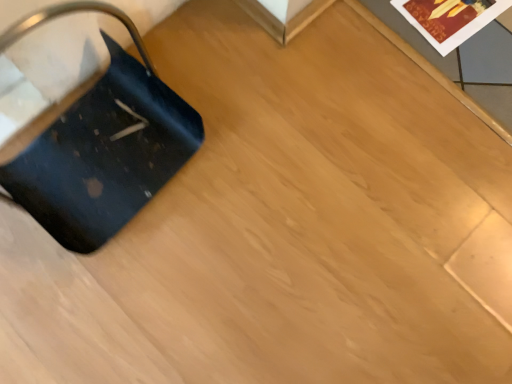
Where is `matte paper postcard at upper right`? matte paper postcard at upper right is located at coordinates (449, 19).

What do you see at coordinates (449, 19) in the screenshot? I see `matte paper postcard at upper right` at bounding box center [449, 19].

Locate an element on the screen. The height and width of the screenshot is (384, 512). matte black suitcase at left is located at coordinates (102, 144).

This screenshot has height=384, width=512. Describe the element at coordinates (102, 144) in the screenshot. I see `matte black suitcase at left` at that location.

This screenshot has height=384, width=512. I want to click on matte paper postcard at upper right, so click(449, 19).

Which object is positioned more to the right, matte black suitcase at left or matte paper postcard at upper right?

Positioned to the right is matte paper postcard at upper right.

Who is more distant, matte black suitcase at left or matte paper postcard at upper right?

matte paper postcard at upper right is further from the camera.

Considering the points (46, 212) and (465, 8), which point is in front, point (46, 212) or point (465, 8)?

Positioned in front is point (46, 212).

From the image's perspective, which is above, matte black suitcase at left or matte paper postcard at upper right?

matte paper postcard at upper right.

From a real-world perspective, which object rests below the other?

matte paper postcard at upper right is physically lower.

Does matte black suitcase at left have a greater width compared to matte paper postcard at upper right?

Indeed, matte black suitcase at left has a greater width compared to matte paper postcard at upper right.

Which of these two, matte black suitcase at left or matte paper postcard at upper right, stands shorter?

With less height is matte paper postcard at upper right.

Who is smaller, matte black suitcase at left or matte paper postcard at upper right?

With smaller size is matte paper postcard at upper right.

Would you say matte black suitcase at left contains matte paper postcard at upper right?

No, matte paper postcard at upper right is not inside matte black suitcase at left.

Is matte black suitcase at left far away from matte paper postcard at upper right?

They are positioned close to each other.

Could you tell me if matte black suitcase at left is facing matte paper postcard at upper right?

No, matte black suitcase at left is not aimed at matte paper postcard at upper right.

The height and width of the screenshot is (384, 512). I want to click on luggage in front of the matte paper postcard at upper right, so click(x=102, y=144).

Which object is positioned more to the left, matte paper postcard at upper right or matte black suitcase at left?

matte black suitcase at left.

Which is in front, matte paper postcard at upper right or matte black suitcase at left?

matte black suitcase at left is more forward.

Is point (460, 12) farther from viewer compared to point (98, 233)?

That is True.

From the image's perspective, who appears lower, matte paper postcard at upper right or matte black suitcase at left?

matte black suitcase at left appears lower in the image.

From a real-world perspective, is matte paper postcard at upper right physically located above or below matte black suitcase at left?

Clearly, from a real-world perspective, matte paper postcard at upper right is below matte black suitcase at left.

Can you confirm if matte paper postcard at upper right is wider than matte black suitcase at left?

No.

Considering the relative sizes of matte paper postcard at upper right and matte black suitcase at left in the image provided, is matte paper postcard at upper right taller than matte black suitcase at left?

In fact, matte paper postcard at upper right may be shorter than matte black suitcase at left.

In terms of size, does matte paper postcard at upper right appear bigger or smaller than matte black suitcase at left?

Clearly, matte paper postcard at upper right is smaller in size than matte black suitcase at left.

Do you think matte paper postcard at upper right is within matte black suitcase at left, or outside of it?

The correct answer is: outside.

Would you consider matte paper postcard at upper right to be distant from matte black suitcase at left?

They are positioned close to each other.

Could you tell me if matte paper postcard at upper right is facing matte black suitcase at left?

No, matte paper postcard at upper right is not aimed at matte black suitcase at left.

Identify the location of luggage that appears on the left of matte paper postcard at upper right. This screenshot has height=384, width=512. (102, 144).

You are a GUI agent. You are given a task and a screenshot of the screen. Output one action in this format:
    pyautogui.click(x=<x>, y=<y>)
    Task: Click on the postcard that appears behind the matte black suitcase at left
    The image size is (512, 384).
    Given the screenshot: What is the action you would take?
    pyautogui.click(x=449, y=19)

Find the location of a particular element. The width and height of the screenshot is (512, 384). luggage below the matte paper postcard at upper right (from the image's perspective) is located at coordinates (102, 144).